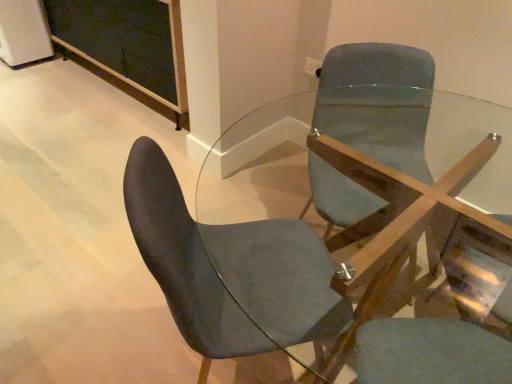
Question: Based on their positions, is velvet dark blue chair at center located to the left or right of matte blue swivel chair at center?

Choices:
 (A) left
 (B) right

Answer: (A)

Question: Looking at their shapes, would you say velvet dark blue chair at center is wider or thinner than matte blue swivel chair at center?

Choices:
 (A) wide
 (B) thin

Answer: (A)

Question: Estimate the real-world distances between objects in this image. Which object is closer to the matte blue swivel chair at center?

Choices:
 (A) velvet dark blue chair at center
 (B) clear glass table at center

Answer: (B)

Question: Based on their relative distances, which object is nearer to the matte blue swivel chair at center?

Choices:
 (A) velvet dark blue chair at center
 (B) clear glass table at center

Answer: (B)